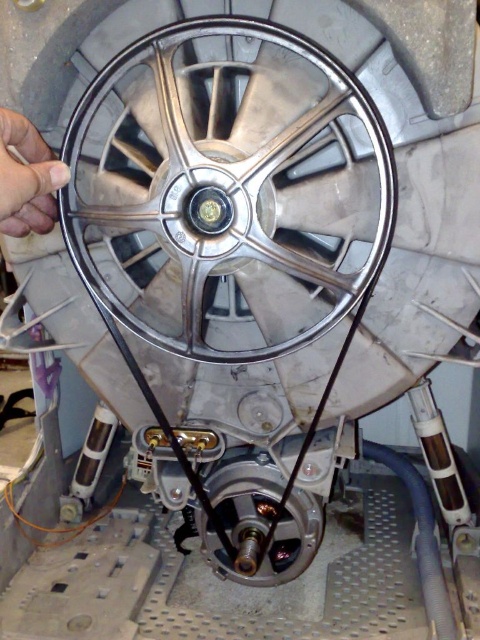
Question: Is the position of metallic silver gear at center less distant than that of silver metallic rim at center?

Choices:
 (A) yes
 (B) no

Answer: (B)

Question: Which point is closer to the camera taking this photo?

Choices:
 (A) (271, 228)
 (B) (269, 500)

Answer: (A)

Question: Can you confirm if polished silver rim at center is positioned below silver metallic rim at center?

Choices:
 (A) no
 (B) yes

Answer: (A)

Question: Which point appears closest to the camera in this image?

Choices:
 (A) pos(205,228)
 (B) pos(303,522)

Answer: (A)

Question: Based on their relative distances, which object is nearer to the metallic silver gear at center?

Choices:
 (A) polished silver rim at center
 (B) silver metallic rim at center

Answer: (A)

Question: Can you confirm if polished silver rim at center is positioned to the left of metallic silver gear at center?

Choices:
 (A) no
 (B) yes

Answer: (B)